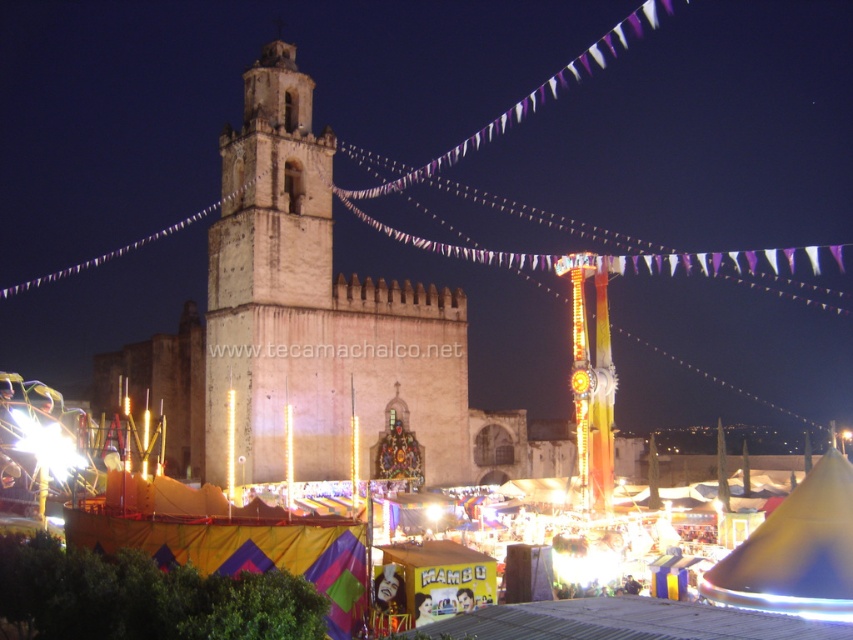
Does light brown stone tower at center appear over multicolored fabric tent at center?

Yes.

The image size is (853, 640). What do you see at coordinates (314, 316) in the screenshot? I see `light brown stone tower at center` at bounding box center [314, 316].

Is point (212, 364) closer to camera compared to point (144, 605)?

No, it is not.

Locate an element on the screen. This screenshot has width=853, height=640. light brown stone tower at center is located at coordinates (314, 316).